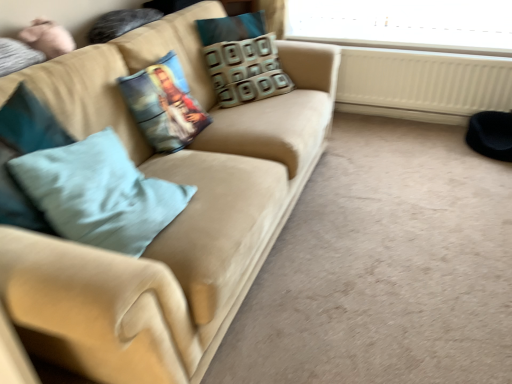
Question: Based on their sizes in the image, would you say suede beige couch at center is bigger or smaller than light blue fabric pillow at left?

Choices:
 (A) small
 (B) big

Answer: (B)

Question: From a real-world perspective, is suede beige couch at center positioned above or below light blue fabric pillow at left?

Choices:
 (A) above
 (B) below

Answer: (B)

Question: Which of these objects is positioned closest to the printed fabric pillow at center, the second pillow in the back-to-front sequence?

Choices:
 (A) white plastic radiator at lower right
 (B) suede beige couch at center
 (C) light blue fabric pillow at left
 (D) patterned fabric pillow at center, acting as the second pillow starting from the left

Answer: (B)

Question: Which is farther from the printed fabric pillow at center, the second pillow in the back-to-front sequence?

Choices:
 (A) white plastic radiator at lower right
 (B) patterned fabric pillow at center, marked as the 2th pillow in a front-to-back arrangement
 (C) light blue fabric pillow at left
 (D) suede beige couch at center

Answer: (A)